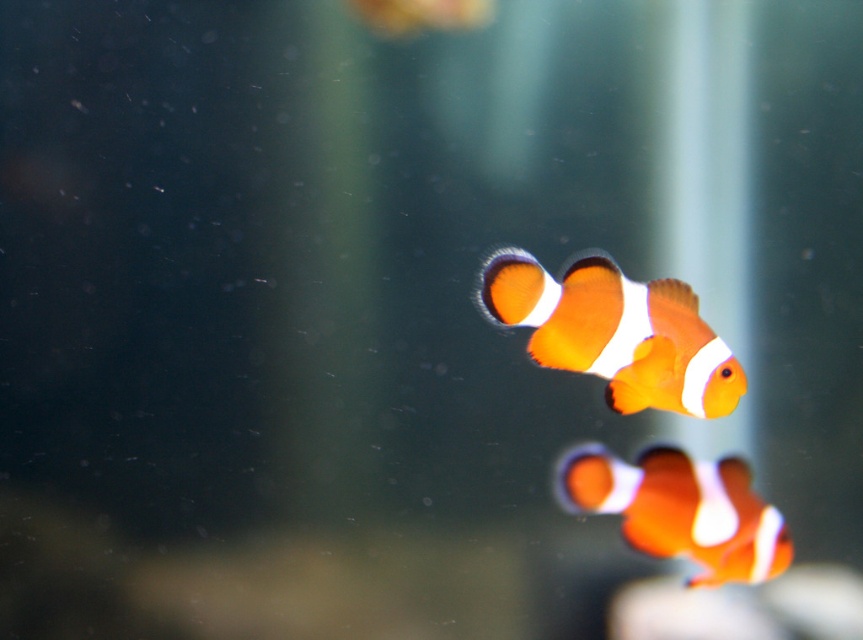
You are an underwater photographer aiming to capture both clownfish in a single frame. Given that the orange matte clownfish at center is above the orange matte clownfish at lower right, can you adjust your camera angle to ensure both are in focus?

The orange matte clownfish at center is above the orange matte clownfish at lower right. By angling the camera to align with their vertical positions, you can ensure both are within the depth of field for a focused shot.